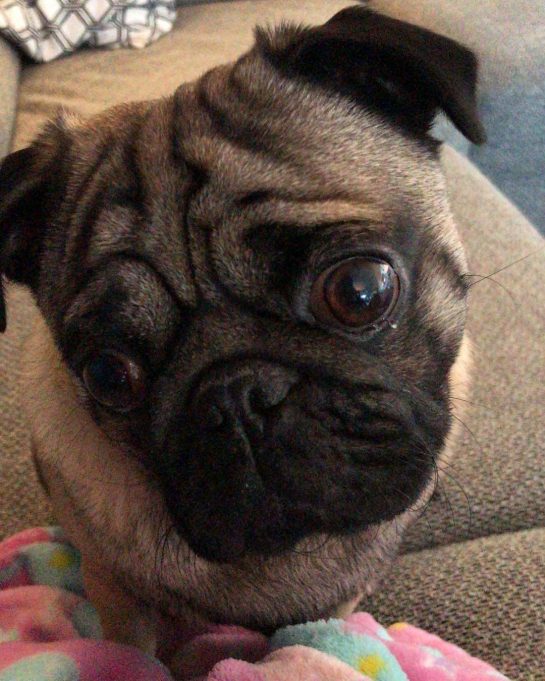
You are a GUI agent. You are given a task and a screenshot of the screen. Output one action in this format:
    pyautogui.click(x=<x>, y=<y>)
    Task: Click on the couch
    This screenshot has height=681, width=545.
    Given the screenshot: What is the action you would take?
    pyautogui.click(x=133, y=76)